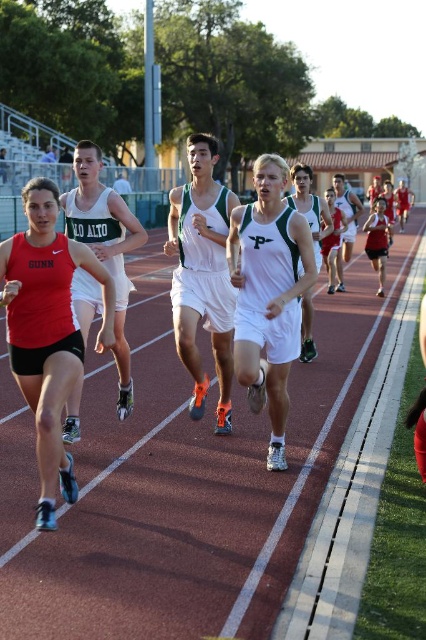
You are a photographer standing at the starting line of the track race. You want to capture a closeup shot of the white athletic uniform at center. Given that your camera has a minimum focusing distance of 5 meters, will you be able to take the photo without moving closer?

The white athletic uniform at center is 6.23 meters away from the camera. Since the minimum focusing distance is 5 meters, the photographer can take the closeup shot without moving closer because the uniform is beyond the minimum required distance.